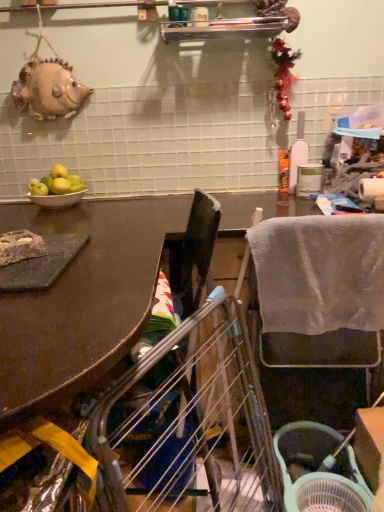
Find the location of `free point to the right of matte gray stone at left`. free point to the right of matte gray stone at left is located at coordinates (100, 257).